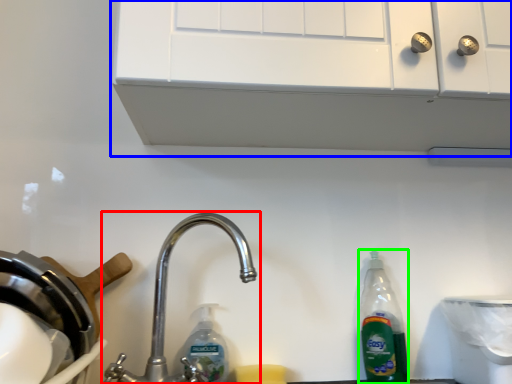
Question: Considering the real-world distances, which object is closest to tap (highlighted by a red box)? vent (highlighted by a blue box) or bottle (highlighted by a green box).

Choices:
 (A) vent
 (B) bottle

Answer: (B)